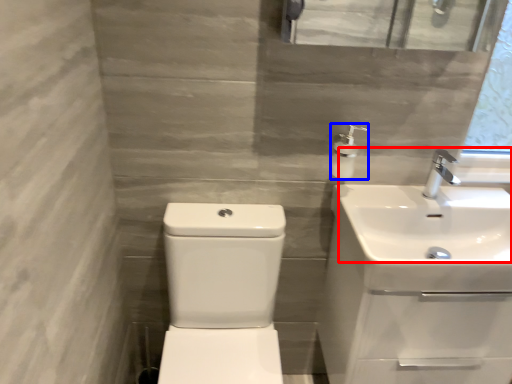
Question: Among these objects, which one is farthest to the camera, sink (highlighted by a red box) or soap dispenser (highlighted by a blue box)?

Choices:
 (A) sink
 (B) soap dispenser

Answer: (B)